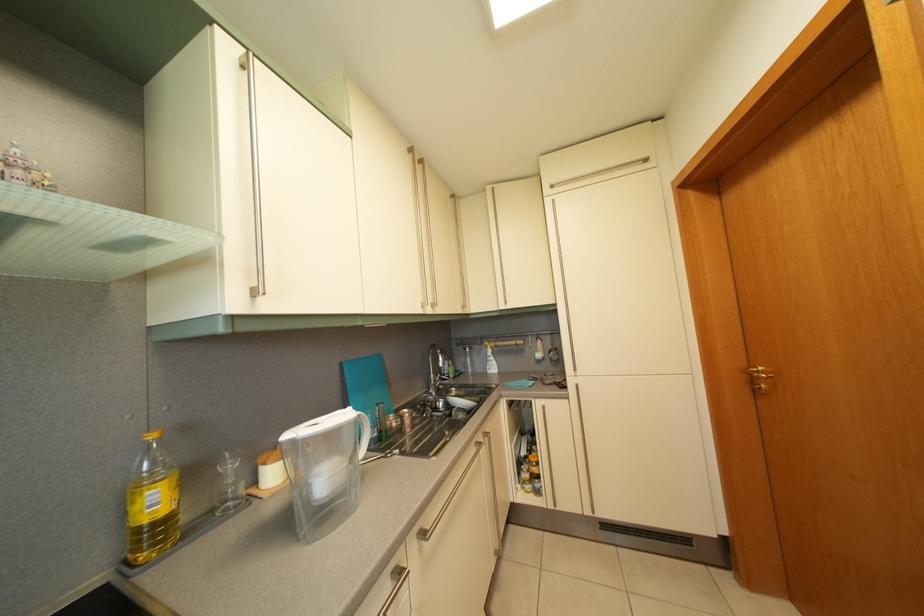
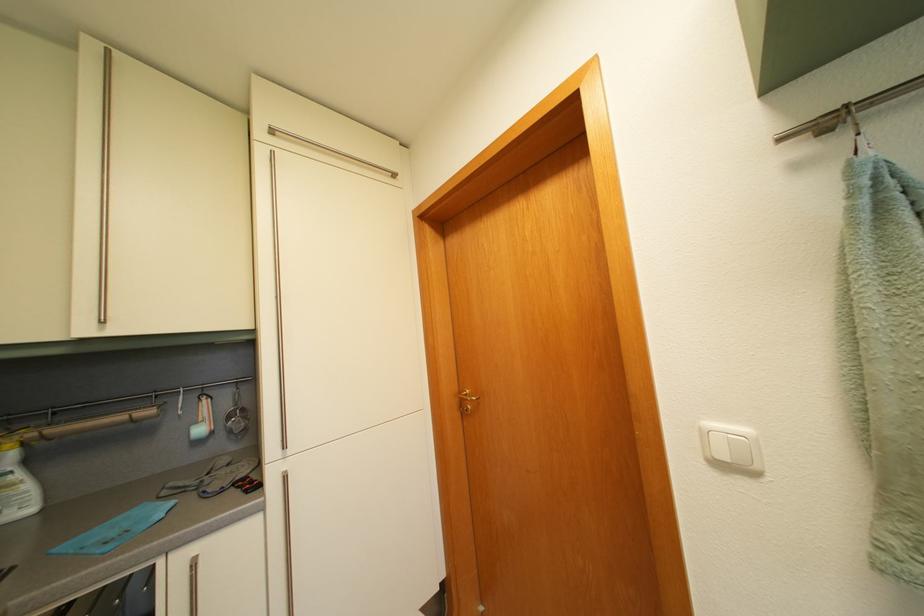
In the second image, find the point that corresponds to (557,359) in the first image.

(237, 424)